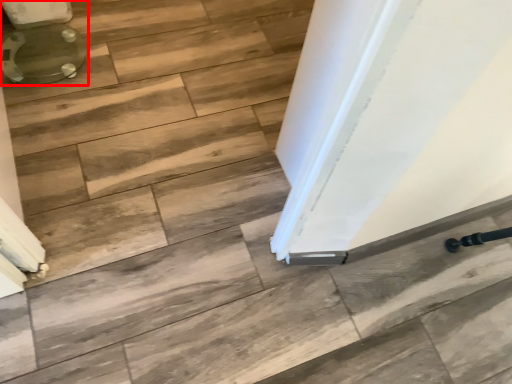
Question: Where is toilet (annotated by the red box) located in relation to stair in the image?

Choices:
 (A) right
 (B) left

Answer: (B)